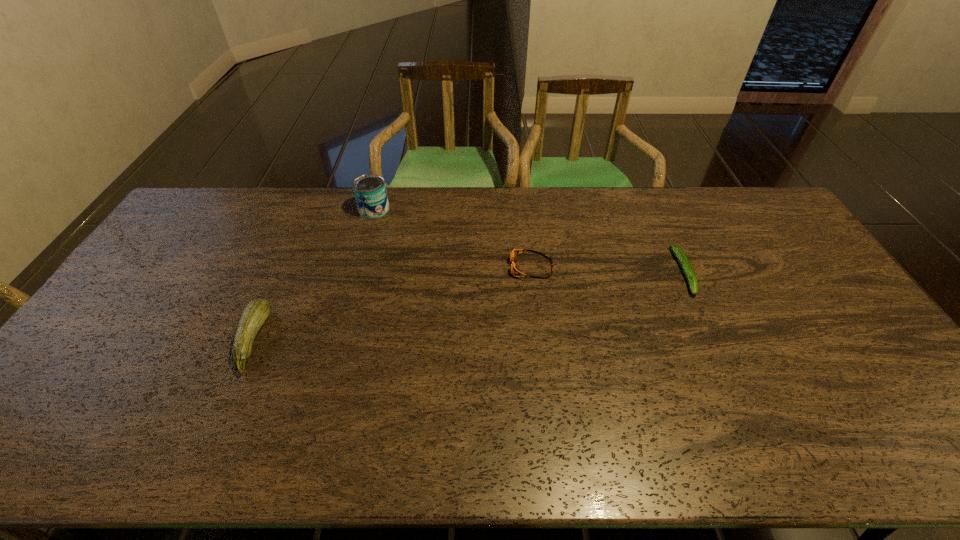
You are a GUI agent. You are given a task and a screenshot of the screen. Output one action in this format:
    pyautogui.click(x=<x>, y=<y>)
    Task: Click on the vacant point located between the farther zucchini and the second object from left to right
    Image resolution: width=960 pixels, height=540 pixels.
    Given the screenshot: What is the action you would take?
    pyautogui.click(x=529, y=240)

This screenshot has height=540, width=960. I want to click on free area in between the farther zucchini and the goggles, so click(608, 269).

Identify the location of free space between the third tallest object and the taller zucchini. The image size is (960, 540). (392, 304).

Where is `free space between the rightmost object and the can`? free space between the rightmost object and the can is located at coordinates (529, 240).

This screenshot has height=540, width=960. In order to click on vacant area between the right zucchini and the second shortest object in this screenshot , I will do `click(608, 269)`.

Where is `empty location between the nearer zucchini and the third object from right to left`? The height and width of the screenshot is (540, 960). empty location between the nearer zucchini and the third object from right to left is located at coordinates (313, 275).

Find the location of a particular element. This screenshot has width=960, height=540. unoccupied area between the goggles and the rightmost object is located at coordinates (608, 269).

The height and width of the screenshot is (540, 960). Identify the location of free space between the shortest object and the second object from right to left. (608, 269).

Find the location of `free space between the tallest object and the shortest object`. free space between the tallest object and the shortest object is located at coordinates (529, 240).

This screenshot has width=960, height=540. Find the location of `object that ranks as the third closest to the goggles`. object that ranks as the third closest to the goggles is located at coordinates (256, 313).